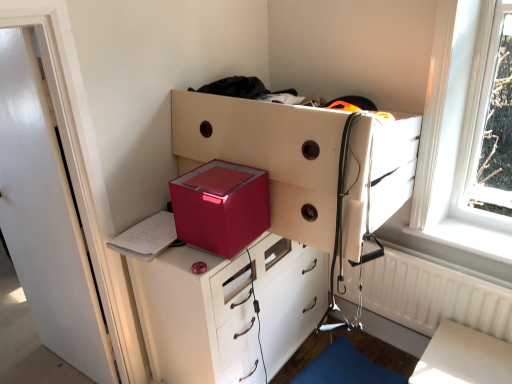
Question: In terms of width, does white textured radiator at right look wider or thinner when compared to metallic white chest of drawers at center, which appears as the second chest of drawers when ordered from the bottom?

Choices:
 (A) thin
 (B) wide

Answer: (A)

Question: Is point (454, 304) closer or farther from the camera than point (323, 190)?

Choices:
 (A) farther
 (B) closer

Answer: (A)

Question: Based on their relative distances, which object is nearer to the blue fabric step stool at lower right?

Choices:
 (A) metallic pink cube at center
 (B) white glossy table at lower right
 (C) white glossy door at left
 (D) metallic white chest of drawers at center, which is the first chest of drawers in top-to-bottom order
 (E) white textured radiator at right

Answer: (E)

Question: Estimate the real-world distances between objects in this image. Which object is closer to the blue fabric step stool at lower right?

Choices:
 (A) white textured radiator at right
 (B) metallic red chest of drawers at center, the 2th chest of drawers in the top-to-bottom sequence
 (C) white glossy table at lower right
 (D) metallic white chest of drawers at center, which is the first chest of drawers in top-to-bottom order
 (E) white glossy door at left

Answer: (A)